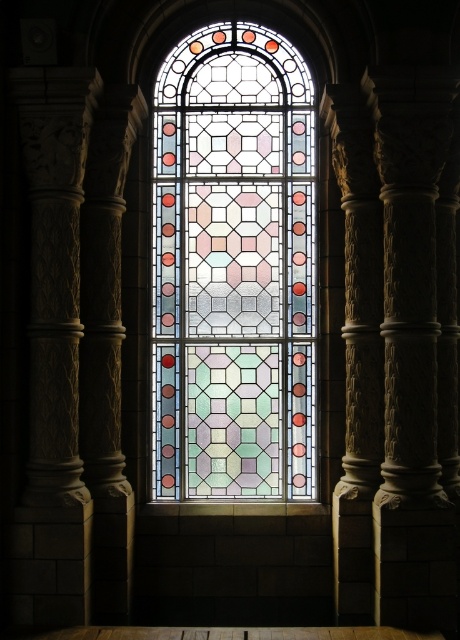
Question: Which object appears closest to the camera in this image?

Choices:
 (A) stained glass window at center
 (B) carved stone column at left

Answer: (B)

Question: Which point is closer to the camera?

Choices:
 (A) stained glass window at center
 (B) carved stone column at left

Answer: (B)

Question: Is stained glass window at center wider than carved stone column at left?

Choices:
 (A) yes
 (B) no

Answer: (A)

Question: From the image, what is the correct spatial relationship of stained glass window at center in relation to carved stone column at left?

Choices:
 (A) above
 (B) below

Answer: (A)

Question: Is stained glass window at center bigger than carved stone column at left?

Choices:
 (A) no
 (B) yes

Answer: (B)